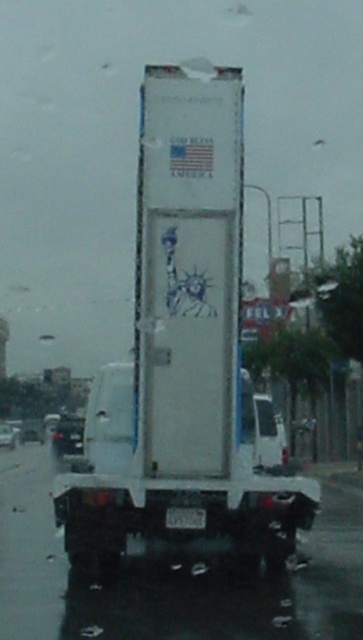
Which is in front, point (254, 397) or point (70, 428)?

Positioned in front is point (254, 397).

Is white matte truck at center below shiny black car at lower left?

Actually, white matte truck at center is above shiny black car at lower left.

Measure the distance between white matte truck at center and camera.

white matte truck at center and camera are 48.01 feet apart.

At what (x,y) coordinates should I click in order to perform the action: click on white matte truck at center. Please return your answer as a coordinate pair (x, y). The width and height of the screenshot is (363, 640). Looking at the image, I should click on (268, 433).

Is white matte trailer truck at center above shiny black car at lower left?

Indeed, white matte trailer truck at center is positioned over shiny black car at lower left.

The image size is (363, 640). I want to click on white matte trailer truck at center, so click(185, 356).

Does shiny black car at lower left have a smaller size compared to black plastic license plate at center?

No, shiny black car at lower left is not smaller than black plastic license plate at center.

Who is lower down, shiny black car at lower left or black plastic license plate at center?

shiny black car at lower left is below.

Image resolution: width=363 pixels, height=640 pixels. Identify the location of shiny black car at lower left. (67, 435).